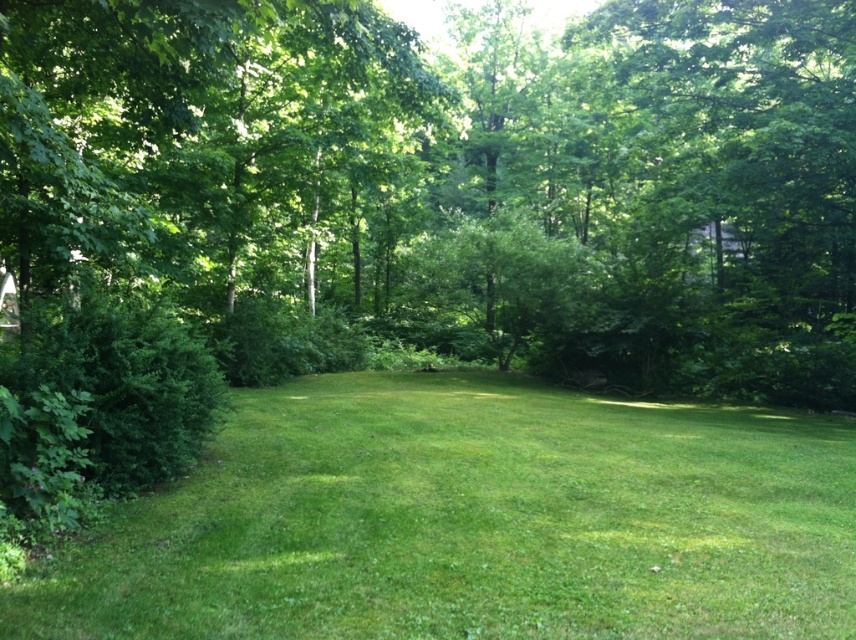
Who is lower down, green leafy tree at center or green grass at center?

green grass at center is below.

Does point (346, 106) come behind point (765, 563)?

Yes, point (346, 106) is farther from viewer.

Does point (841, 227) come farther from viewer compared to point (266, 422)?

Yes, it is.

Where is `green leafy tree at center`? green leafy tree at center is located at coordinates (449, 182).